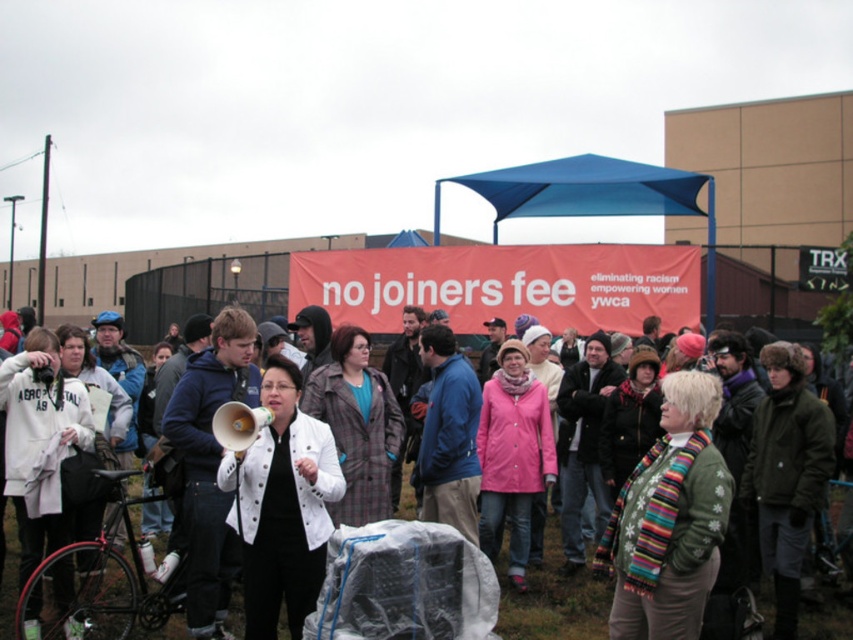
Locate an element on the screen. Image resolution: width=853 pixels, height=640 pixels. blue fleece jacket at center is located at coordinates (209, 465).

You are a GUI agent. You are given a task and a screenshot of the screen. Output one action in this format:
    pyautogui.click(x=<x>, y=<y>)
    Task: Click on the blue fleece jacket at center
    
    Given the screenshot: What is the action you would take?
    pyautogui.click(x=209, y=465)

Between point (231, 445) and point (485, 371), which one is positioned behind?

Positioned behind is point (485, 371).

The image size is (853, 640). Describe the element at coordinates (238, 424) in the screenshot. I see `matte green megaphone at center` at that location.

At what (x,y) coordinates should I click in order to perform the action: click on matte green megaphone at center. Please return your answer as a coordinate pair (x, y). The image size is (853, 640). Looking at the image, I should click on (238, 424).

Is blue fleece jacket at center positioned behind matte green megaphone at center?

Yes, it is behind matte green megaphone at center.

Between point (194, 589) and point (229, 435), which one is positioned behind?

Point (194, 589)

This screenshot has width=853, height=640. Find the location of `blue fleece jacket at center`. blue fleece jacket at center is located at coordinates (209, 465).